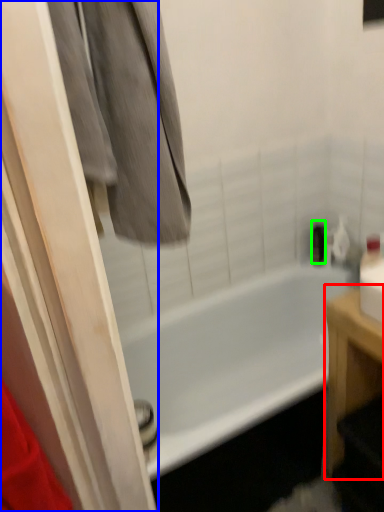
Question: Which object is positioned closest to furniture (highlighted by a red box)? Select from screen door (highlighted by a blue box) and toiletry (highlighted by a green box).

Choices:
 (A) screen door
 (B) toiletry

Answer: (A)